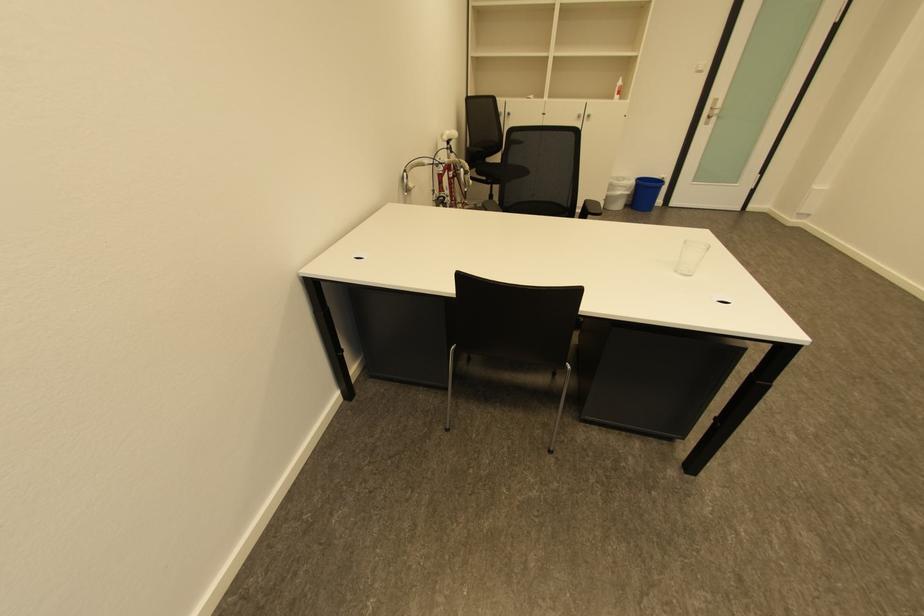
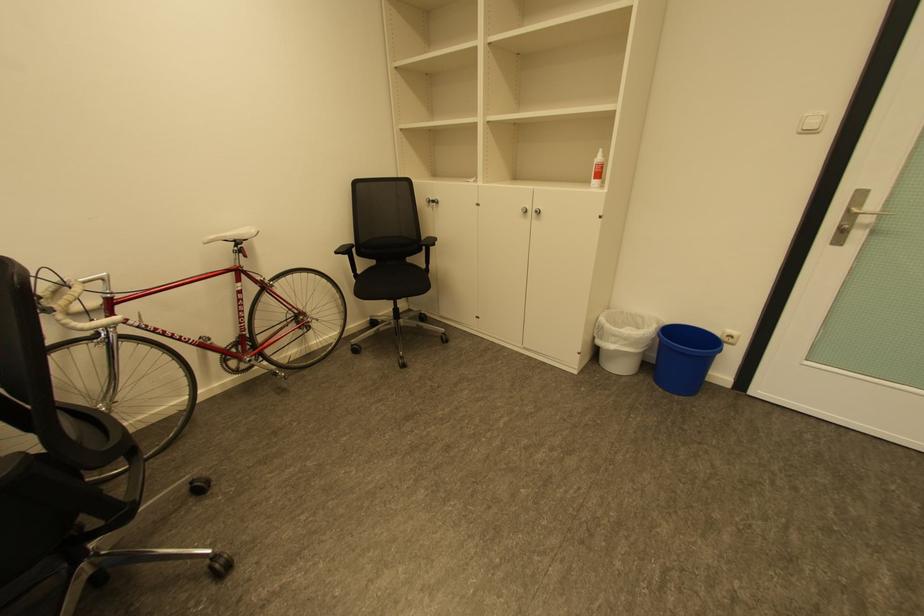
Where in the second image is the point corresponding to point 626,188 from the first image?

(622, 337)